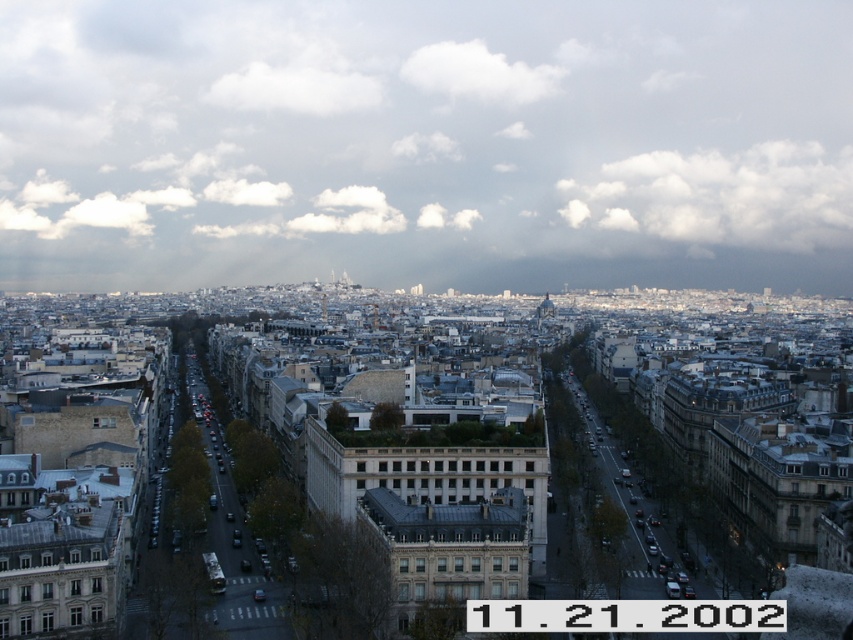
You are standing at the vantage point overlooking the city and want to determine the spatial relationship between two points marked on your map. Which point is closer to you, the point at coordinates (537, 259) or the point at (532, 76)?

Point (537, 259) is closer to you because it is in front of point (532, 76).

In the scene shown: You are an airplane passenger looking out the window and see the white fluffy clouds at upper center and the white fluffy cloud at upper right. Which cloud is larger in size?

The white fluffy clouds at upper center might be wider than white fluffy cloud at upper right, so the white fluffy clouds at upper center is larger in size.

You are standing at a high vantage point overlooking the city. You notice two points marked in the image. The first point is at coordinates point [239,84] and the second is at point [602,189]. Based on the city layout, which point is farther away from your current position?

Point [239,84] is behind point [602,189], so it is farther away from your current position.